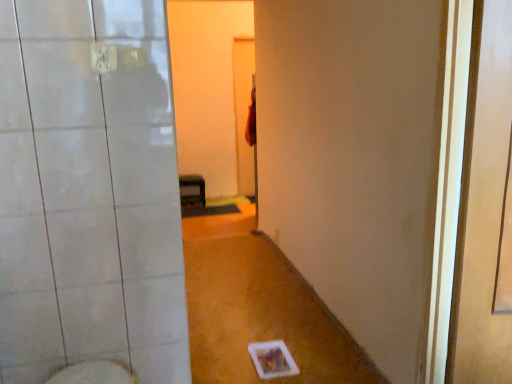
Question: Does white glossy bidet at lower left have a larger size compared to transparent plastic screen door at right?

Choices:
 (A) no
 (B) yes

Answer: (A)

Question: Is the depth of white glossy bidet at lower left greater than that of transparent plastic screen door at right?

Choices:
 (A) yes
 (B) no

Answer: (A)

Question: Does white glossy bidet at lower left turn towards transparent plastic screen door at right?

Choices:
 (A) no
 (B) yes

Answer: (A)

Question: Does white glossy bidet at lower left appear on the right side of transparent plastic screen door at right?

Choices:
 (A) yes
 (B) no

Answer: (B)

Question: Is white glossy bidet at lower left next to transparent plastic screen door at right?

Choices:
 (A) yes
 (B) no

Answer: (B)

Question: Is matte black shelf at center wider or thinner than white glossy bidet at lower left?

Choices:
 (A) wide
 (B) thin

Answer: (A)

Question: Is matte black shelf at center inside or outside of white glossy bidet at lower left?

Choices:
 (A) outside
 (B) inside

Answer: (A)

Question: In the image, is matte black shelf at center positioned in front of or behind white glossy bidet at lower left?

Choices:
 (A) front
 (B) behind

Answer: (B)

Question: In terms of size, does matte black shelf at center appear bigger or smaller than white glossy bidet at lower left?

Choices:
 (A) big
 (B) small

Answer: (A)

Question: Considering the positions of transparent plastic screen door at right and white glossy bidet at lower left in the image, is transparent plastic screen door at right bigger or smaller than white glossy bidet at lower left?

Choices:
 (A) small
 (B) big

Answer: (B)

Question: Is transparent plastic screen door at right spatially inside white glossy bidet at lower left, or outside of it?

Choices:
 (A) inside
 (B) outside

Answer: (B)

Question: Is transparent plastic screen door at right in front of or behind white glossy bidet at lower left in the image?

Choices:
 (A) front
 (B) behind

Answer: (A)

Question: Does point (459, 347) appear closer or farther from the camera than point (113, 364)?

Choices:
 (A) farther
 (B) closer

Answer: (A)

Question: Considering the positions of white glossy bidet at lower left and transparent plastic screen door at right in the image, is white glossy bidet at lower left taller or shorter than transparent plastic screen door at right?

Choices:
 (A) short
 (B) tall

Answer: (A)

Question: Is white glossy bidet at lower left bigger or smaller than transparent plastic screen door at right?

Choices:
 (A) small
 (B) big

Answer: (A)